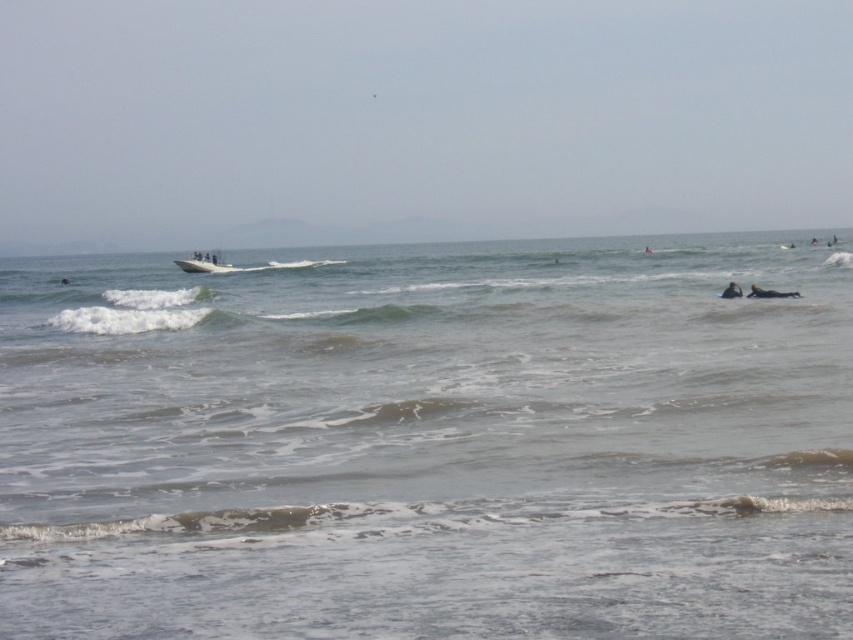
Which is more to the left, black rubber surfboard at lower right or black wetsuit at lower right?

black wetsuit at lower right is more to the left.

Does black rubber surfboard at lower right appear over black wetsuit at lower right?

Incorrect, black rubber surfboard at lower right is not positioned above black wetsuit at lower right.

The height and width of the screenshot is (640, 853). I want to click on black rubber surfboard at lower right, so click(770, 292).

Identify the location of black rubber surfboard at lower right. (770, 292).

Consider the image. Is gray matte water at center above white plastic surfboard at center?

Correct, gray matte water at center is located above white plastic surfboard at center.

Can you confirm if gray matte water at center is positioned to the left of white plastic surfboard at center?

Incorrect, gray matte water at center is not on the left side of white plastic surfboard at center.

Who is more forward, [421,538] or [196,253]?

Positioned in front is point [421,538].

At what (x,y) coordinates should I click in order to perform the action: click on gray matte water at center. Please return your answer as a coordinate pair (x, y). The image size is (853, 640). Looking at the image, I should click on (428, 442).

Can you confirm if gray matte water at center is positioned to the left of black wetsuit at lower right?

Correct, you'll find gray matte water at center to the left of black wetsuit at lower right.

Is point (807, 483) closer to camera compared to point (721, 296)?

Yes.

Find the location of `gray matte water at center`. gray matte water at center is located at coordinates (428, 442).